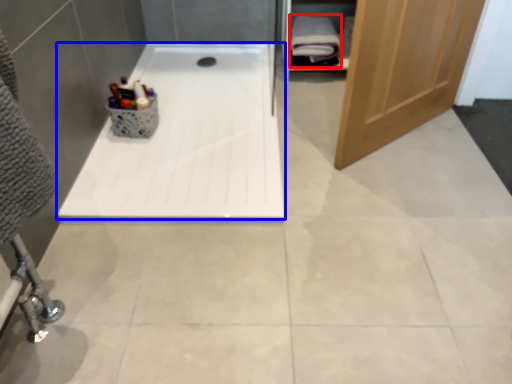
Question: Which of the following is the farthest to the observer, bath towel (highlighted by a red box) or bathtub (highlighted by a blue box)?

Choices:
 (A) bath towel
 (B) bathtub

Answer: (A)